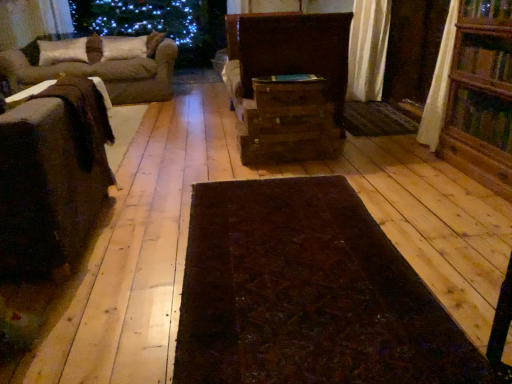
At what (x,y) coordinates should I click in order to perform the action: click on suede-like beige pillow at upper left, the 1th pillow viewed from the left. Please return your answer as a coordinate pair (x, y). Image resolution: width=512 pixels, height=384 pixels. Looking at the image, I should click on (62, 51).

Image resolution: width=512 pixels, height=384 pixels. What do you see at coordinates (481, 96) in the screenshot? I see `wooden bookshelf at right` at bounding box center [481, 96].

This screenshot has height=384, width=512. What do you see at coordinates (288, 84) in the screenshot?
I see `wooden trunk at center, which is the 1th furniture from back to front` at bounding box center [288, 84].

You are a GUI agent. You are given a task and a screenshot of the screen. Output one action in this format:
    pyautogui.click(x=<x>, y=<y>)
    Task: Click on the suede-like beige pillow at upper left, the 1th pillow positioned from the right
    The image size is (512, 384).
    Given the screenshot: What is the action you would take?
    pyautogui.click(x=124, y=47)

Could you tell me if wooden chest at center, which ranks as the 3th drawer in bottom-to-top order, is facing brown textured mat at center, the 1th mat viewed from the right?

No, wooden chest at center, which ranks as the 3th drawer in bottom-to-top order, is not oriented towards brown textured mat at center, the 1th mat viewed from the right.

Is wooden chest at center, which ranks as the 3th drawer in bottom-to-top order, situated inside brown textured mat at center, the 1th mat viewed from the right, or outside?

wooden chest at center, which ranks as the 3th drawer in bottom-to-top order, cannot be found inside brown textured mat at center, the 1th mat viewed from the right.

How much distance is there between wooden chest at center, placed as the first drawer when sorted from top to bottom, and brown textured mat at center, the 2th mat when ordered from left to right?

They are 3.79 feet apart.

What's the angular difference between dark brown textured mat at center, the first mat positioned from the front, and wooden bookshelf at right's facing directions?

92.5 degrees.

Considering the sizes of dark brown textured mat at center, which ranks as the 2th mat in right-to-left order, and wooden bookshelf at right in the image, is dark brown textured mat at center, which ranks as the 2th mat in right-to-left order, taller or shorter than wooden bookshelf at right?

Considering their sizes, dark brown textured mat at center, which ranks as the 2th mat in right-to-left order, has less height than wooden bookshelf at right.

Is dark brown textured mat at center, which ranks as the 1th mat in left-to-right order, positioned far away from wooden bookshelf at right?

dark brown textured mat at center, which ranks as the 1th mat in left-to-right order, is positioned a significant distance from wooden bookshelf at right.

From the image's perspective, which is above, dark brown textured mat at center, the 1th mat from the bottom, or wooden bookshelf at right?

wooden bookshelf at right, from the image's perspective.

What's the angular difference between suede-like beige pillow at upper left, the second pillow when ordered from right to left, and wooden trunk at center, which is the 1th furniture from back to front,'s facing directions?

They differ by 89.7 degrees in their facing directions.

From a real-world perspective, is suede-like beige pillow at upper left, the 1th pillow viewed from the left, positioned over wooden trunk at center, the second furniture when ordered from front to back, based on gravity?

Yes, from a real-world perspective, suede-like beige pillow at upper left, the 1th pillow viewed from the left, is on top of wooden trunk at center, the second furniture when ordered from front to back.

Which of these two, suede-like beige pillow at upper left, the second pillow when ordered from right to left, or wooden trunk at center, the second furniture positioned from the left, stands shorter?

With less height is suede-like beige pillow at upper left, the second pillow when ordered from right to left.

Is suede-like beige pillow at upper left, the 1th pillow viewed from the left, turned away from wooden trunk at center, which appears as the first furniture when viewed from the right?

No, suede-like beige pillow at upper left, the 1th pillow viewed from the left, is not facing away from wooden trunk at center, which appears as the first furniture when viewed from the right.

From the image's perspective, which one is positioned lower, wooden trunk at center, the second furniture positioned from the left, or wooden drawer at center, which ranks as the second drawer in bottom-to-top order?

wooden drawer at center, which ranks as the second drawer in bottom-to-top order, from the image's perspective.

From a real-world perspective, is wooden trunk at center, the second furniture positioned from the left, located higher than wooden drawer at center, which ranks as the second drawer in bottom-to-top order?

Correct, in the physical world, wooden trunk at center, the second furniture positioned from the left, is higher than wooden drawer at center, which ranks as the second drawer in bottom-to-top order.

Can wooden drawer at center, placed as the 2th drawer when sorted from top to bottom, be found inside wooden trunk at center, the second furniture when ordered from front to back?

Actually, wooden drawer at center, placed as the 2th drawer when sorted from top to bottom, is outside wooden trunk at center, the second furniture when ordered from front to back.

Does point (330, 16) lie behind point (263, 123)?

Yes.

Is suede-like beige pillow at upper left, the 1th pillow positioned from the right, not inside wooden table at left?

That's correct, suede-like beige pillow at upper left, the 1th pillow positioned from the right, is outside of wooden table at left.

Considering the points (126, 57) and (8, 100), which point is in front, point (126, 57) or point (8, 100)?

Positioned in front is point (8, 100).

I want to click on table located below the suede-like beige pillow at upper left, which is the second pillow in left-to-right order (from the image's perspective), so click(x=27, y=93).

How distant is wooden table at left from brown fabric couch at left?

wooden table at left and brown fabric couch at left are 9.54 feet apart from each other.

From a real-world perspective, which object rests below the other?

brown fabric couch at left.

Is wooden table at left oriented away from brown fabric couch at left?

wooden table at left is not turned away from brown fabric couch at left.

Considering the positions of point (259, 89) and point (250, 126), is point (259, 89) closer or farther from the camera than point (250, 126)?

Clearly, point (259, 89) is more distant from the camera than point (250, 126).

Is brown wooden drawer at center, which is counted as the 3th drawer, starting from the top, completely or partially outside of wooden drawer at center, placed as the 2th drawer when sorted from top to bottom?

brown wooden drawer at center, which is counted as the 3th drawer, starting from the top, is positioned outside wooden drawer at center, placed as the 2th drawer when sorted from top to bottom.

What's the angular difference between brown wooden drawer at center, the first drawer positioned from the bottom, and wooden drawer at center, which ranks as the second drawer in bottom-to-top order,'s facing directions?

There is a 3.03-degree angle between the facing directions of brown wooden drawer at center, the first drawer positioned from the bottom, and wooden drawer at center, which ranks as the second drawer in bottom-to-top order.

Between brown wooden drawer at center, which is counted as the 3th drawer, starting from the top, and wooden drawer at center, which ranks as the second drawer in bottom-to-top order, which one is positioned behind?

brown wooden drawer at center, which is counted as the 3th drawer, starting from the top, is further away from the camera.

Locate an element on the screen. This screenshot has width=512, height=384. the 1st drawer counting from the left of the brown textured mat at center, which appears as the first mat when viewed from the back is located at coordinates (289, 93).

Where is `bookshelf on the right of dark brown textured mat at center, which ranks as the 2th mat in right-to-left order`? The image size is (512, 384). bookshelf on the right of dark brown textured mat at center, which ranks as the 2th mat in right-to-left order is located at coordinates (481, 96).

When comparing their distances from dark brown textured mat at center, the 1th mat from the bottom, does wooden bookshelf at right or wooden table at left seem further?

wooden table at left lies further to dark brown textured mat at center, the 1th mat from the bottom, than the other object.

Looking at the image, which one is located further to brown fabric couch at left, wooden table at left or brown textured mat at center, the 2th mat when ordered from left to right?

Among the two, wooden table at left is located further to brown fabric couch at left.

When comparing their distances from suede-like beige pillow at upper left, the second pillow when ordered from right to left, does wooden table at left or brown wooden drawer at center, the first drawer positioned from the bottom, seem further?

Among the two, wooden table at left is located further to suede-like beige pillow at upper left, the second pillow when ordered from right to left.

Considering their positions, is wooden chest at center, which ranks as the 3th drawer in bottom-to-top order, positioned further to wooden bookshelf at right than dark brown fabric couch at left, positioned as the 1th furniture in left-to-right order?

dark brown fabric couch at left, positioned as the 1th furniture in left-to-right order, is further to wooden bookshelf at right.

From the image, which object appears to be nearer to brown fabric couch at left, brown wooden drawer at center, which is counted as the 3th drawer, starting from the top, or suede-like beige pillow at upper left, which is the second pillow in left-to-right order?

suede-like beige pillow at upper left, which is the second pillow in left-to-right order, is positioned closer to the anchor brown fabric couch at left.

From the image, which object appears to be farther from brown textured mat at center, which appears as the first mat when viewed from the back, suede-like beige pillow at upper left, which is the second pillow in left-to-right order, or wooden bookshelf at right?

Based on the image, suede-like beige pillow at upper left, which is the second pillow in left-to-right order, appears to be further to brown textured mat at center, which appears as the first mat when viewed from the back.

Looking at the image, which one is located closer to wooden trunk at center, the second furniture when ordered from front to back, wooden drawer at center, which ranks as the second drawer in bottom-to-top order, or wooden bookshelf at right?

wooden drawer at center, which ranks as the second drawer in bottom-to-top order.

Based on the photo, considering their positions, is brown fabric couch at left positioned further to dark brown fabric couch at left, the 1th furniture positioned from the front, than wooden chest at center, which ranks as the 3th drawer in bottom-to-top order?

Among the two, brown fabric couch at left is located further to dark brown fabric couch at left, the 1th furniture positioned from the front.

Where is `table located between suede-like beige pillow at upper left, the 1th pillow viewed from the left, and brown textured mat at center, which appears as the 2th mat when viewed from the front, in the left-right direction`? Image resolution: width=512 pixels, height=384 pixels. table located between suede-like beige pillow at upper left, the 1th pillow viewed from the left, and brown textured mat at center, which appears as the 2th mat when viewed from the front, in the left-right direction is located at coordinates (27, 93).

Locate an element on the screen. The image size is (512, 384). bookshelf located between dark brown fabric couch at left, which appears as the 2th furniture when viewed from the back, and suede-like beige pillow at upper left, the 1th pillow positioned from the right, in the depth direction is located at coordinates (481, 96).

Image resolution: width=512 pixels, height=384 pixels. Find the location of `drawer located between dark brown textured mat at center, which ranks as the 2th mat in right-to-left order, and wooden drawer at center, which ranks as the second drawer in bottom-to-top order, in the depth direction`. drawer located between dark brown textured mat at center, which ranks as the 2th mat in right-to-left order, and wooden drawer at center, which ranks as the second drawer in bottom-to-top order, in the depth direction is located at coordinates (289, 93).

Identify the location of furniture located between dark brown textured mat at center, the second mat positioned from the back, and wooden trunk at center, the second furniture positioned from the left, in the depth direction. (52, 176).